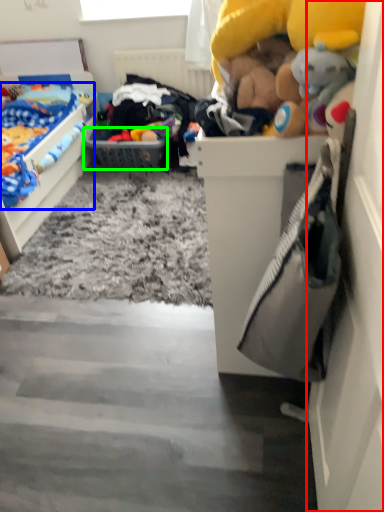
Question: Which object is the closest to the door (highlighted by a red box)? Choose among these: toy (highlighted by a blue box) or picnic basket (highlighted by a green box).

Choices:
 (A) toy
 (B) picnic basket

Answer: (A)